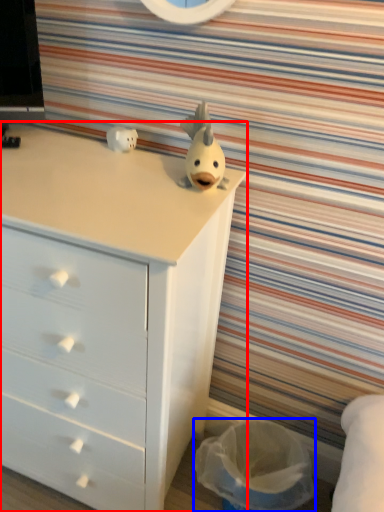
Question: Which point is closer to the camera, chest of drawers (highlighted by a red box) or laundry basket (highlighted by a blue box)?

Choices:
 (A) chest of drawers
 (B) laundry basket

Answer: (A)